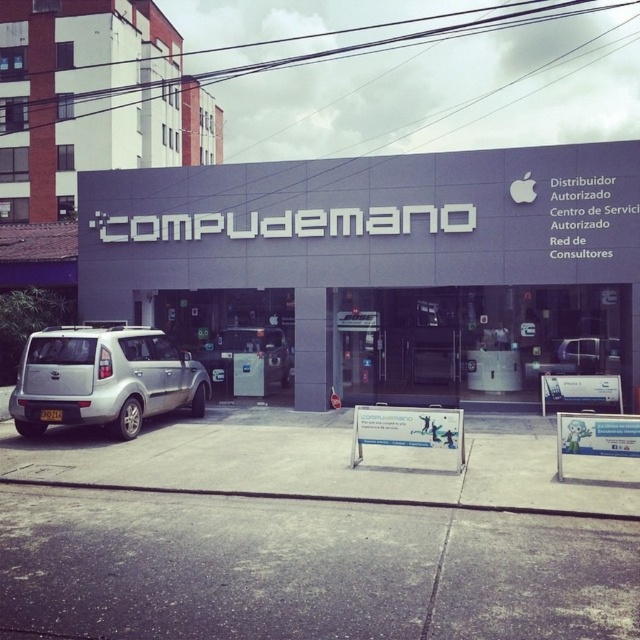
Is point (220, 352) positioned in front of point (163, 344)?

No, it is not.

Can you confirm if matte gray building at center is bigger than silver metallic van at lower left?

Yes, matte gray building at center is bigger than silver metallic van at lower left.

Which is in front, point (385, 257) or point (42, 397)?

Positioned in front is point (42, 397).

This screenshot has height=640, width=640. I want to click on matte gray building at center, so click(384, 268).